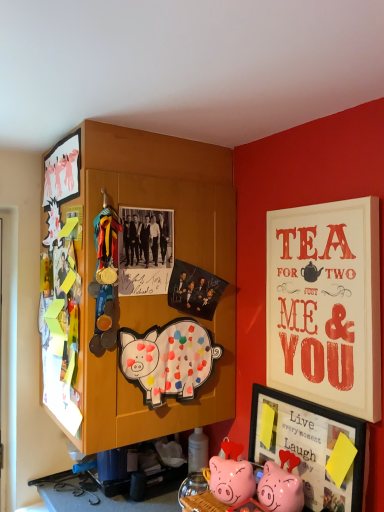
Question: Is matte white picture frame at upper left, acting as the first picture frame starting from the top, taller than matte white signboard at upper right, which ranks as the first picture frame in right-to-left order?

Choices:
 (A) yes
 (B) no

Answer: (B)

Question: From a real-world perspective, is matte white picture frame at upper left, the 3th picture frame positioned from the right, located higher than matte white signboard at upper right, acting as the 2th picture frame starting from the bottom?

Choices:
 (A) yes
 (B) no

Answer: (A)

Question: Does matte white picture frame at upper left, the 3th picture frame positioned from the right, have a larger size compared to matte white signboard at upper right, which ranks as the first picture frame in right-to-left order?

Choices:
 (A) yes
 (B) no

Answer: (B)

Question: Does matte white picture frame at upper left, which is counted as the third picture frame, starting from the bottom, have a greater width compared to matte white signboard at upper right, which is the 2th picture frame in top-to-bottom order?

Choices:
 (A) no
 (B) yes

Answer: (A)

Question: Considering the relative positions of matte white picture frame at upper left, acting as the first picture frame starting from the top, and matte white signboard at upper right, the 3th picture frame when ordered from left to right, in the image provided, is matte white picture frame at upper left, acting as the first picture frame starting from the top, to the left of matte white signboard at upper right, the 3th picture frame when ordered from left to right, from the viewer's perspective?

Choices:
 (A) yes
 (B) no

Answer: (A)

Question: Is matte white picture frame at upper left, acting as the first picture frame starting from the top, to the right of matte white signboard at upper right, the 3th picture frame when ordered from left to right, from the viewer's perspective?

Choices:
 (A) yes
 (B) no

Answer: (B)

Question: From a real-world perspective, is matte black photo at upper center located higher than matte black picture frame at lower right, which is the second picture frame in left-to-right order?

Choices:
 (A) yes
 (B) no

Answer: (A)

Question: Does matte black photo at upper center appear on the right side of matte black picture frame at lower right, the 2th picture frame when ordered from right to left?

Choices:
 (A) no
 (B) yes

Answer: (A)

Question: From the image's perspective, is matte black photo at upper center above matte black picture frame at lower right, the 2th picture frame when ordered from right to left?

Choices:
 (A) no
 (B) yes

Answer: (B)

Question: Considering the relative positions of matte black photo at upper center and matte black picture frame at lower right, the first picture frame positioned from the bottom, in the image provided, is matte black photo at upper center in front of matte black picture frame at lower right, the first picture frame positioned from the bottom,?

Choices:
 (A) yes
 (B) no

Answer: (B)

Question: From the image's perspective, does matte black photo at upper center appear lower than matte black picture frame at lower right, which is the second picture frame in left-to-right order?

Choices:
 (A) no
 (B) yes

Answer: (A)

Question: Is matte black photo at upper center bigger than matte black picture frame at lower right, which ranks as the third picture frame in top-to-bottom order?

Choices:
 (A) yes
 (B) no

Answer: (B)

Question: Are matte white signboard at upper right, acting as the 2th picture frame starting from the bottom, and painted paper pig at center making contact?

Choices:
 (A) yes
 (B) no

Answer: (B)